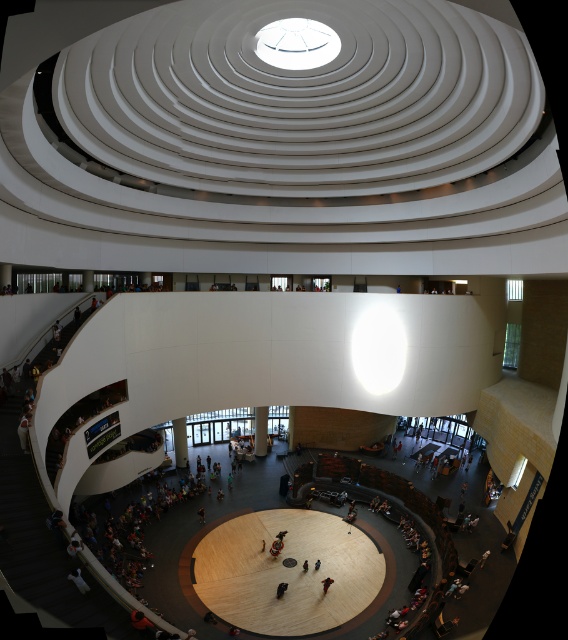
Is white glossy pillar at center below dark brown leather jacket at center?

No.

Is white glossy pillar at center above dark brown leather jacket at center?

Yes.

Between point (185, 422) and point (279, 584), which one is positioned behind?

The point (185, 422) is behind.

Find the location of `white glossy pillar at center`. white glossy pillar at center is located at coordinates pyautogui.click(x=179, y=442).

Is point (176, 433) in front of point (256, 420)?

Yes.

You are a GUI agent. You are given a task and a screenshot of the screen. Output one action in this format:
    pyautogui.click(x=<x>, y=<y>)
    Task: Click on the white glossy pillar at center
    The height and width of the screenshot is (640, 568).
    Given the screenshot: What is the action you would take?
    pyautogui.click(x=179, y=442)

Does point (257, 428) lie in front of point (316, 564)?

No, it is behind (316, 564).

Who is shorter, white smooth pillar at center or dark blue fabric person at center?

dark blue fabric person at center

Is point (260, 449) positioned behind point (318, 564)?

Yes, it is.

I want to click on white smooth pillar at center, so click(x=261, y=429).